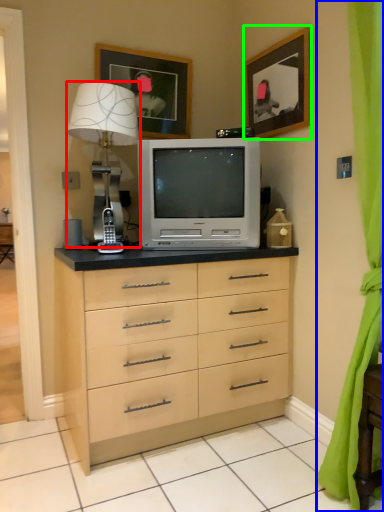
Question: Considering the real-world distances, which object is farthest from table lamp (highlighted by a red box)? curtain (highlighted by a blue box) or picture frame (highlighted by a green box)?

Choices:
 (A) curtain
 (B) picture frame

Answer: (A)